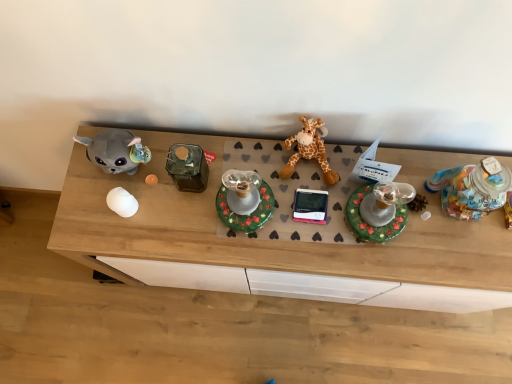
Locate an element on the screen. Image resolution: width=512 pixels, height=384 pixels. space that is in front of translucent plastic jar at right, positioned as the fourth toy in left-to-right order is located at coordinates (466, 259).